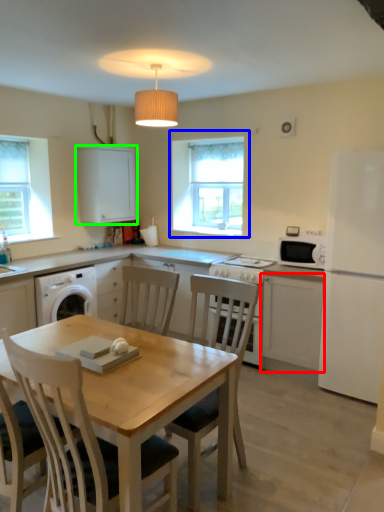
Question: Estimate the real-world distances between objects in this image. Which object is farther from cabinetry (highlighted by a red box), window (highlighted by a blue box) or cabinetry (highlighted by a green box)?

Choices:
 (A) window
 (B) cabinetry

Answer: (B)